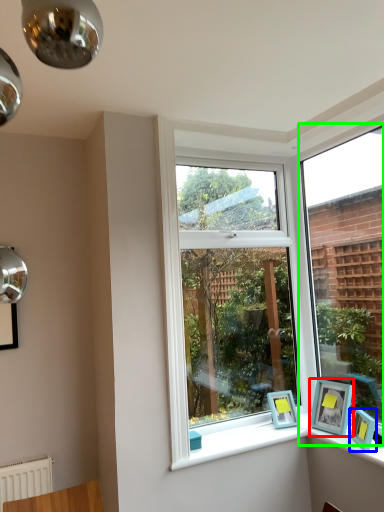
Question: Based on their relative distances, which object is nearer to picture frame (highlighted by a red box)? Choose from picture frame (highlighted by a blue box) and window (highlighted by a green box).

Choices:
 (A) picture frame
 (B) window

Answer: (A)